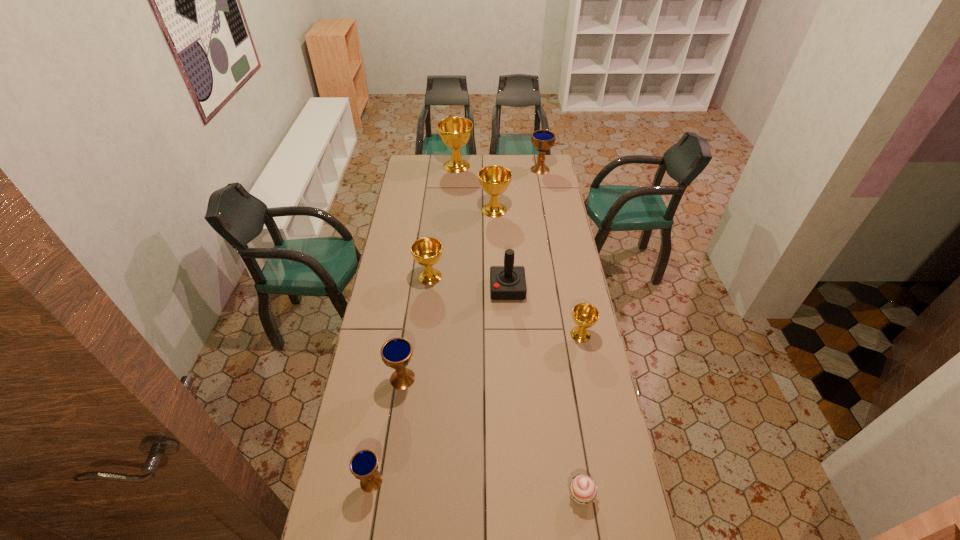
The height and width of the screenshot is (540, 960). What are the coordinates of `the fourth farthest chalice` in the screenshot? It's located at (427, 251).

Locate an element on the screen. the smallest gold chalice is located at coordinates (585, 315).

What are the coordinates of `the rightmost gold chalice` in the screenshot? It's located at coord(585,315).

Where is `the smallest blue chalice`? the smallest blue chalice is located at coordinates click(364, 464).

The width and height of the screenshot is (960, 540). I want to click on the nearest blue chalice, so click(364, 464).

I want to click on the shortest object, so (x=583, y=489).

At what (x,y) coordinates should I click in order to perform the action: click on cupcake. Please return your answer as a coordinate pair (x, y). The width and height of the screenshot is (960, 540). Looking at the image, I should click on (583, 489).

The height and width of the screenshot is (540, 960). What are the coordinates of `free region located 0.070m on the left of the tallest chalice` in the screenshot? It's located at (428, 166).

Where is `vacant space situated on the back of the rightmost blue chalice`? vacant space situated on the back of the rightmost blue chalice is located at coordinates (538, 155).

Locate an element on the screen. This screenshot has height=540, width=960. vacant space located 0.160m on the right of the fifth chalice from left to right is located at coordinates (540, 210).